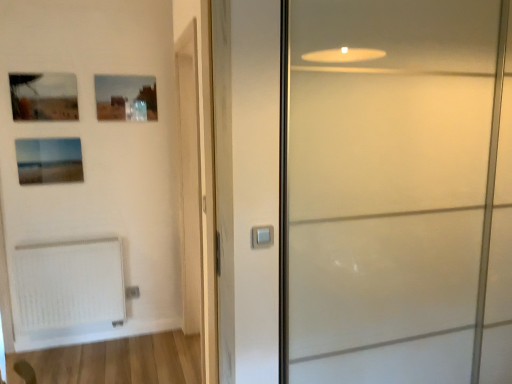
You are a GUI agent. You are given a task and a screenshot of the screen. Output one action in this format:
    pyautogui.click(x=<x>, y=<y>)
    Task: Click on the free space above white textured radiator at lower left (from a real-world perspective)
    This screenshot has width=512, height=384.
    Given the screenshot: What is the action you would take?
    coord(56,242)